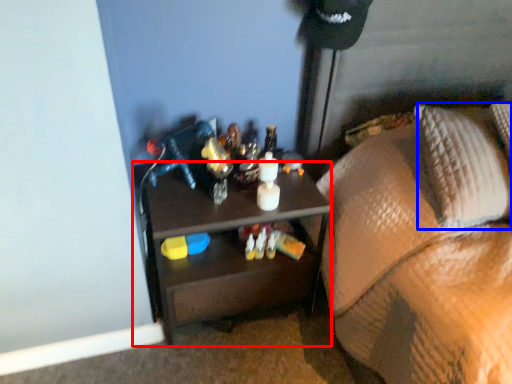
Question: Which point is further to the camera, desk (highlighted by a red box) or pillow (highlighted by a blue box)?

Choices:
 (A) desk
 (B) pillow

Answer: (A)